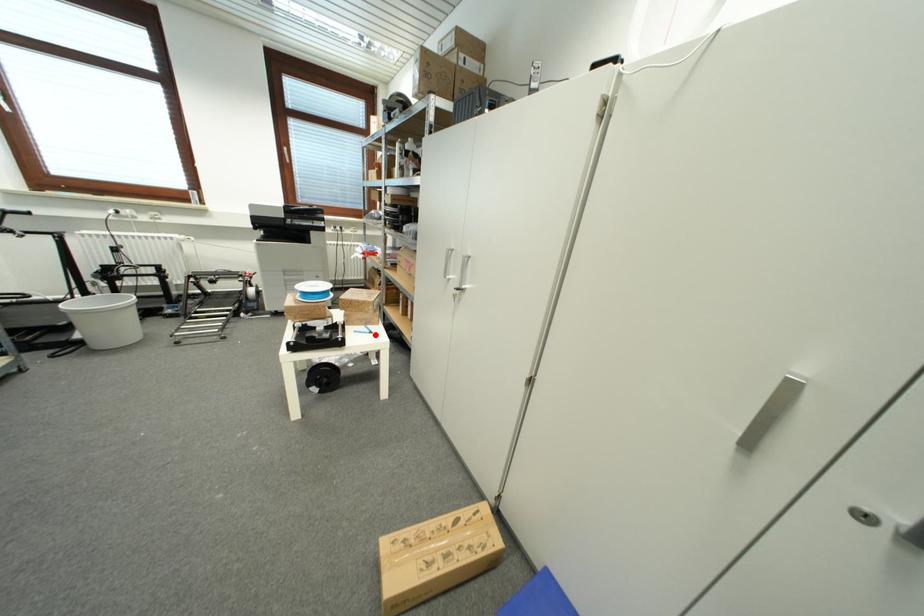
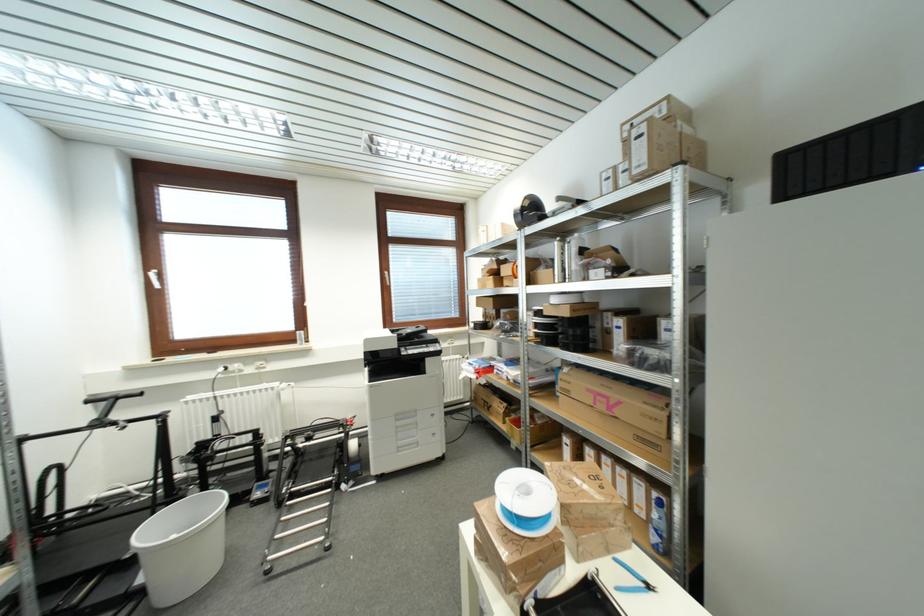
Question: I am providing you with two images of the same scene from different viewpoints. Image1 has a red point marked. In image2, the corresponding 3D location appears at what relative position? Reply with the corresponding letter.

Choices:
 (A) Closer
 (B) Farther

Answer: (B)